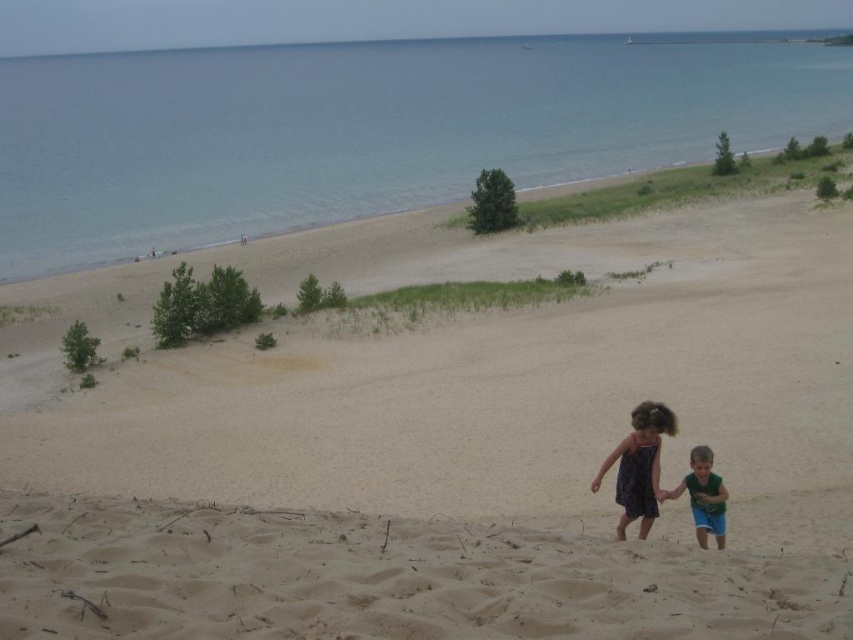
You are standing on the beach and want to locate the blue water at upper center. According to the coordinates provided, where should you look?

You should look at point 0.205 on the horizontal axis and 0.431 on the vertical axis to locate the blue water at upper center.

You are a photographer standing on the beige sandy beach at center and want to take a photo of the dark purple dress at lower center. Since the dress is taller than the beach, where should you position yourself to ensure the dress is fully visible in the frame?

Since the dark purple dress at lower center is taller than the beige sandy beach at center, you should position yourself at a lower angle or closer to the ground to ensure the entire dress is visible in the photo.

You are standing on the beige sandy beach at center and want to walk towards the blue water at upper center. Which direction should you head?

You should head to the left because the blue water at upper center is located to the left of the beige sandy beach at center.